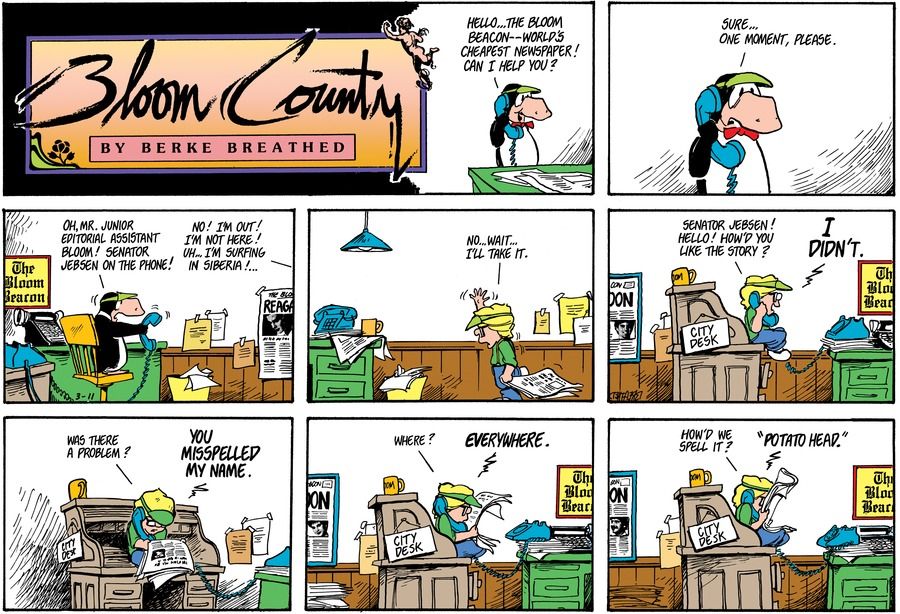
Where is `frames`? frames is located at coordinates (487, 95), (662, 102), (141, 290), (379, 290), (751, 298), (150, 476), (757, 492).